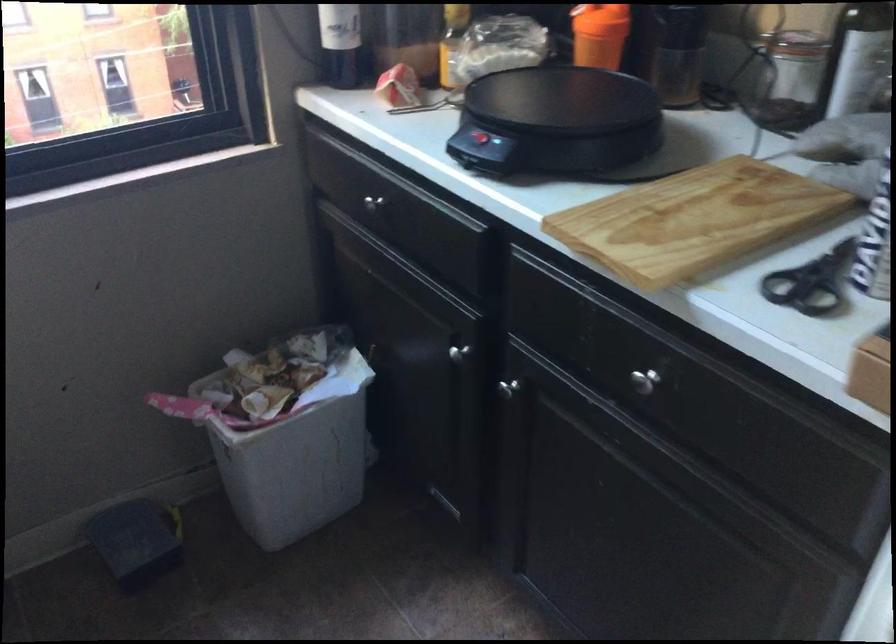
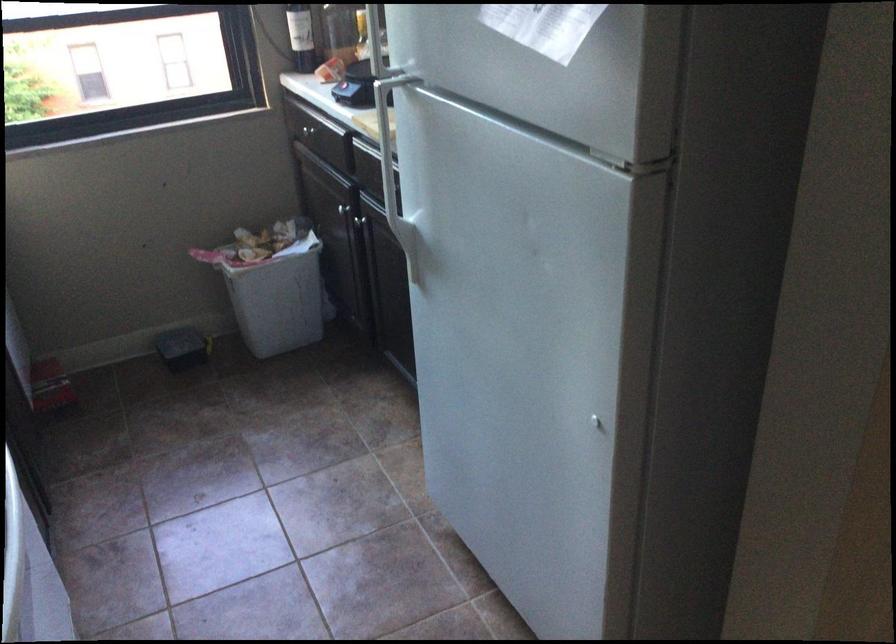
Find the pixel in the second image that matches the point at 304,469 in the first image.

(278, 297)